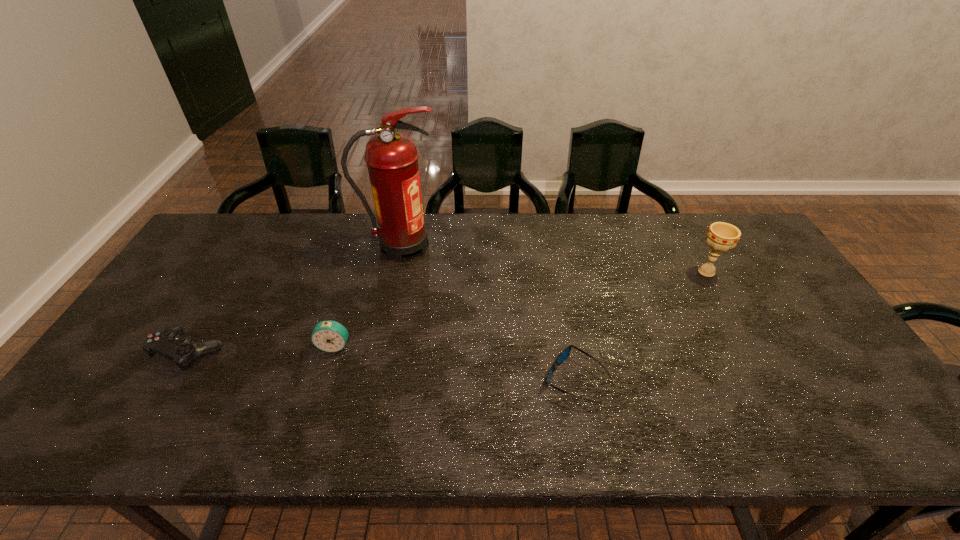
At what (x,y) coordinates should I click in order to perform the action: click on empty space that is in between the second tallest object and the tallest object. Please return your answer as a coordinate pair (x, y). Looking at the image, I should click on (554, 259).

The height and width of the screenshot is (540, 960). Find the location of `free space between the farthest object and the rightmost object`. free space between the farthest object and the rightmost object is located at coordinates (554, 259).

Locate an element on the screen. This screenshot has height=540, width=960. vacant area that lies between the control and the third tallest object is located at coordinates (262, 348).

In order to click on vacant space that's between the farthest object and the control in this screenshot , I will do `click(296, 299)`.

Find the location of a particular element. This screenshot has height=540, width=960. free spot between the sunglasses and the third tallest object is located at coordinates (455, 363).

Locate an element on the screen. The height and width of the screenshot is (540, 960). object that stands as the closest to the second object from right to left is located at coordinates (720, 237).

Select which object appears as the second closest to the second farthest object. Please provide its 2D coordinates. Your answer should be formatted as a tuple, i.e. [(x, y)], where the tuple contains the x and y coordinates of a point satisfying the conditions above.

[(392, 158)]

This screenshot has width=960, height=540. Find the location of `free space that satisfies the following two spatial constraints: 1. on the front-facing side of the farthest object; 2. on the front-facing side of the third tallest object`. free space that satisfies the following two spatial constraints: 1. on the front-facing side of the farthest object; 2. on the front-facing side of the third tallest object is located at coordinates (381, 346).

Locate an element on the screen. vacant point that satisfies the following two spatial constraints: 1. on the front-facing side of the fire extinguisher; 2. on the front-facing side of the third shortest object is located at coordinates (381, 346).

Locate an element on the screen. free spot that satisfies the following two spatial constraints: 1. on the front-facing side of the second farthest object; 2. on the right side of the tallest object is located at coordinates (396, 272).